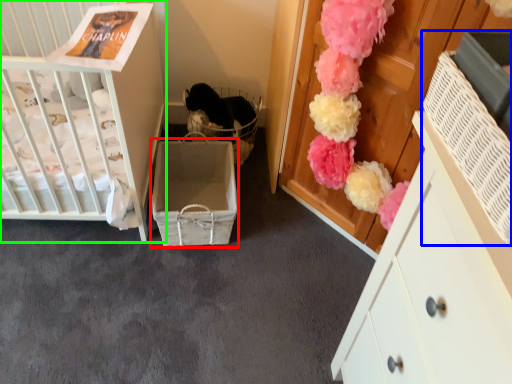
Question: Estimate the real-world distances between objects in this image. Which object is closer to storage box (highlighted by a red box), storage box (highlighted by a blue box) or infant bed (highlighted by a green box)?

Choices:
 (A) storage box
 (B) infant bed

Answer: (B)